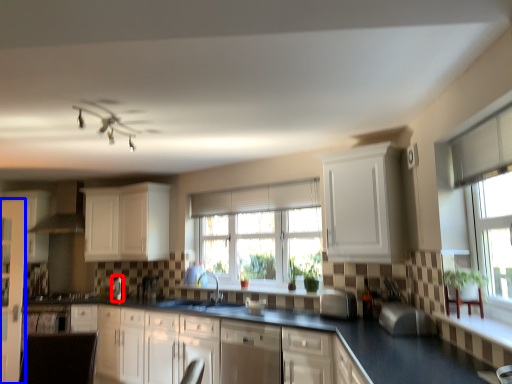
Question: Among these objects, which one is nearest to the camera, appliance (highlighted by a red box) or screen door (highlighted by a blue box)?

Choices:
 (A) appliance
 (B) screen door

Answer: (B)